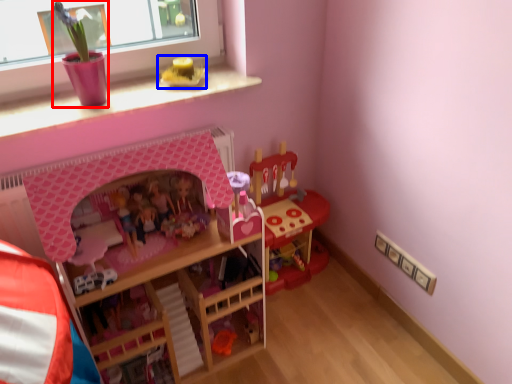
Question: Which point is closer to the camera, toy (highlighted by a red box) or toy (highlighted by a blue box)?

Choices:
 (A) toy
 (B) toy

Answer: (A)